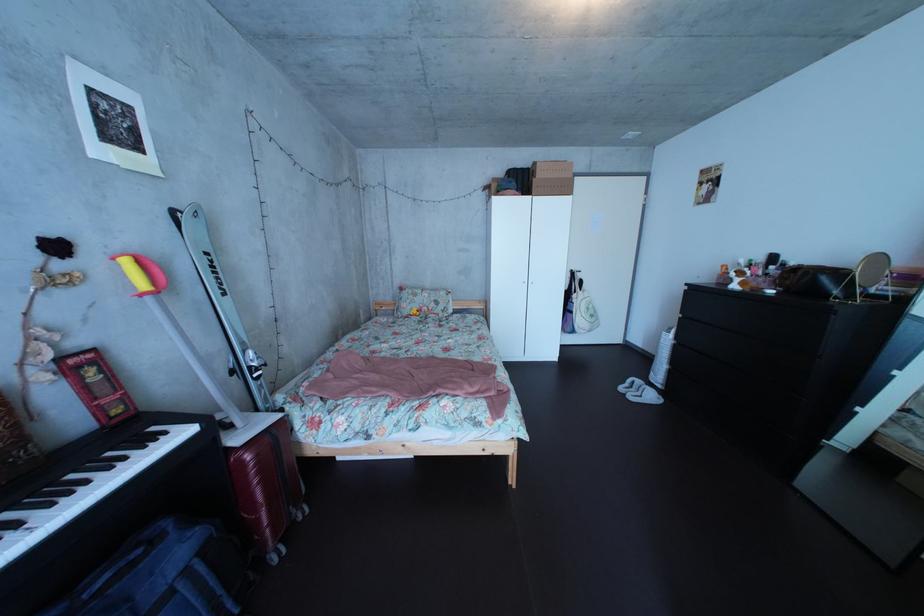
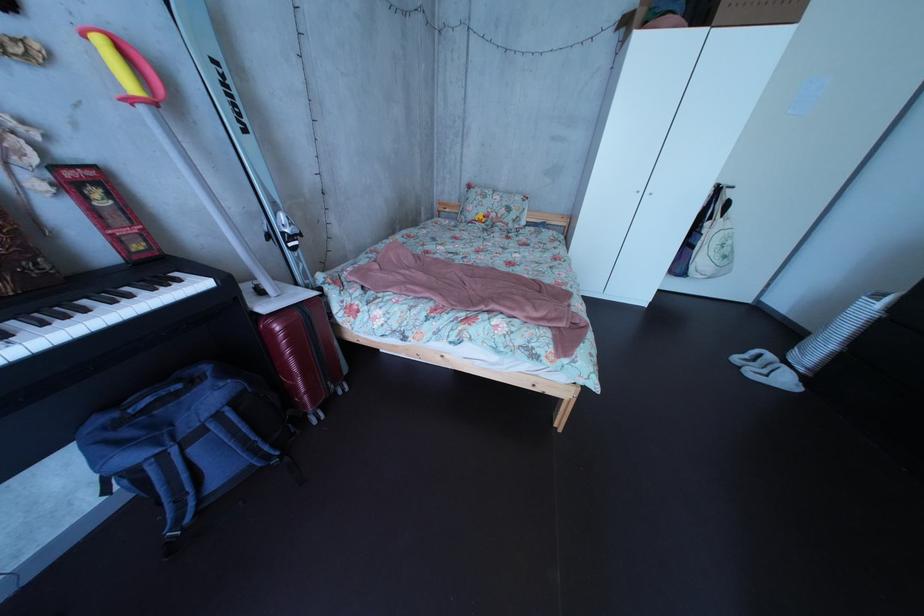
Where in the second image is the point corresponding to (x=430, y=307) from the first image?

(499, 209)